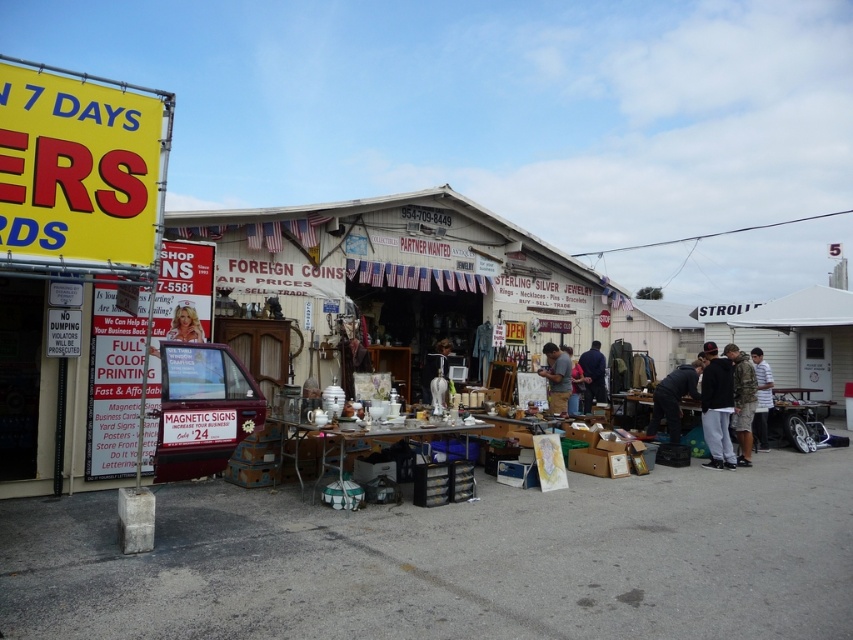
Consider the image. Which is above, black cotton pants at lower right or camouflage uniform at center?

black cotton pants at lower right

Is black cotton pants at lower right to the left of camouflage uniform at center from the viewer's perspective?

Indeed, black cotton pants at lower right is positioned on the left side of camouflage uniform at center.

Does point (720, 364) lie in front of point (740, 440)?

That is True.

The image size is (853, 640). I want to click on black cotton pants at lower right, so click(x=717, y=406).

Which is in front, point (683, 365) or point (549, 348)?

Positioned in front is point (683, 365).

Measure the distance from dark gray fabric jacket at lower right to matte gray shirt at center.

The distance of dark gray fabric jacket at lower right from matte gray shirt at center is 5.63 feet.

Where is `dark gray fabric jacket at lower right`? This screenshot has height=640, width=853. dark gray fabric jacket at lower right is located at coordinates (672, 397).

Between point (660, 410) and point (766, 422), which one is positioned behind?

Positioned behind is point (766, 422).

Looking at this image, is dark gray fabric jacket at lower right shorter than white striped shirt at center?

In fact, dark gray fabric jacket at lower right may be taller than white striped shirt at center.

This screenshot has height=640, width=853. What do you see at coordinates (672, 397) in the screenshot?
I see `dark gray fabric jacket at lower right` at bounding box center [672, 397].

Image resolution: width=853 pixels, height=640 pixels. Identify the location of dark gray fabric jacket at lower right. (672, 397).